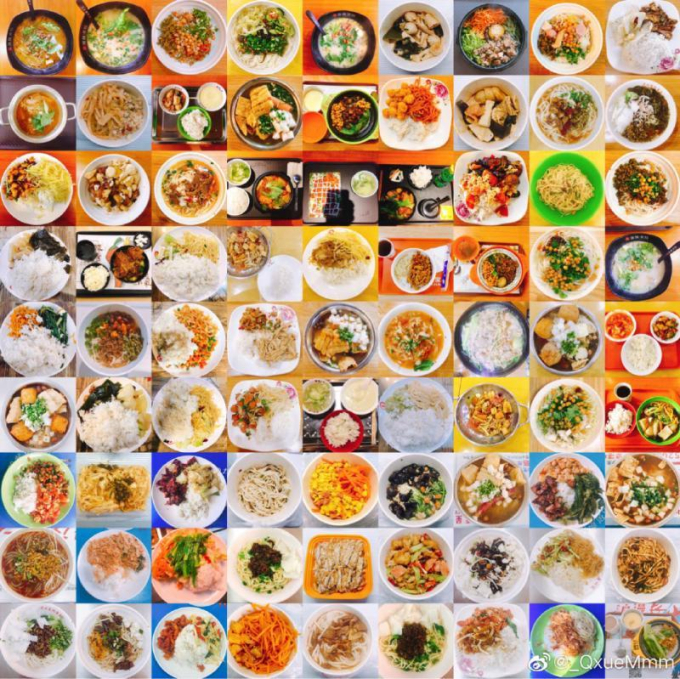
Where is `bottom row of photographs`? bottom row of photographs is located at coordinates (41, 642), (119, 644), (188, 644), (260, 646), (343, 646), (411, 646), (491, 646), (568, 648), (645, 650).